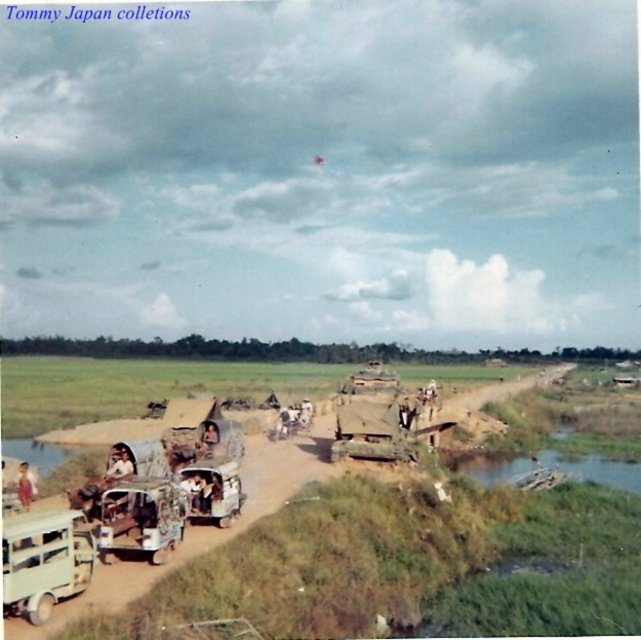
Question: Which object is farther from the camera taking this photo?

Choices:
 (A) light brown fabric hat at center
 (B) light beige fabric truck at lower left
 (C) light brown wooden chair at lower left

Answer: (A)

Question: Does light brown fabric hat at center have a lesser width compared to light brown leather jacket at lower left?

Choices:
 (A) yes
 (B) no

Answer: (B)

Question: Which of the following is the farthest from the observer?

Choices:
 (A) light brown wooden chair at lower left
 (B) green grassy river at lower right
 (C) rusty metal truck at lower left
 (D) light brown leather jacket at lower left

Answer: (B)

Question: Can you confirm if light beige fabric truck at lower left is positioned to the right of green grassy river at lower right?

Choices:
 (A) yes
 (B) no

Answer: (B)

Question: Which of these objects is positioned closest to the green grassy river at lower right?

Choices:
 (A) light brown fabric hat at center
 (B) rusty metal truck at lower left
 (C) light brown wooden chair at lower left
 (D) light beige fabric truck at lower left

Answer: (A)

Question: Does rusty metal truck at lower left appear on the left side of green grassy river at lower right?

Choices:
 (A) no
 (B) yes

Answer: (B)